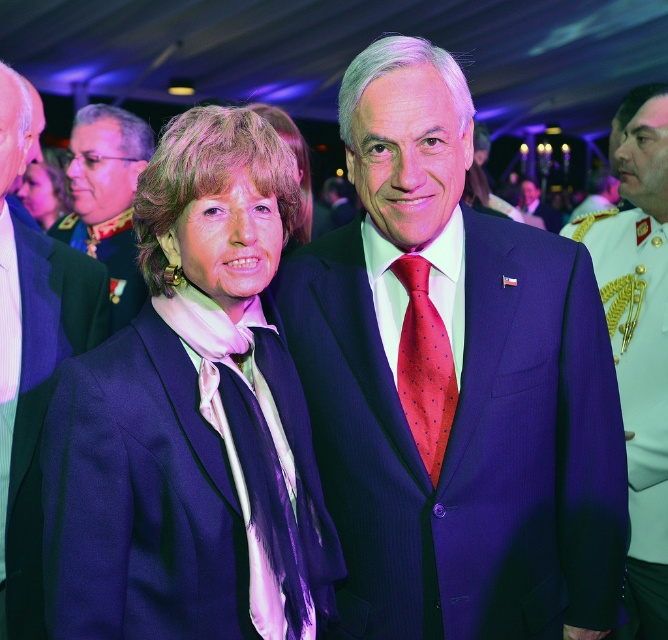
From the picture: You are a photographer at this event. You need to capture a photo that includes both the gold embroidered uniform at right and the green military uniform at center. Based on their positions, which uniform should you focus on first to ensure both are in frame?

The gold embroidered uniform at right is located below the green military uniform at center, so you should focus on the green military uniform at center first to ensure both are in frame.

You are standing in the center of the image and want to move towards the green wool suit at left. In which direction should you move?

Since the green wool suit at left is located at point 0.566 on the x axis and 0.048 on the y axis, you should move to the left and slightly downward to reach it.